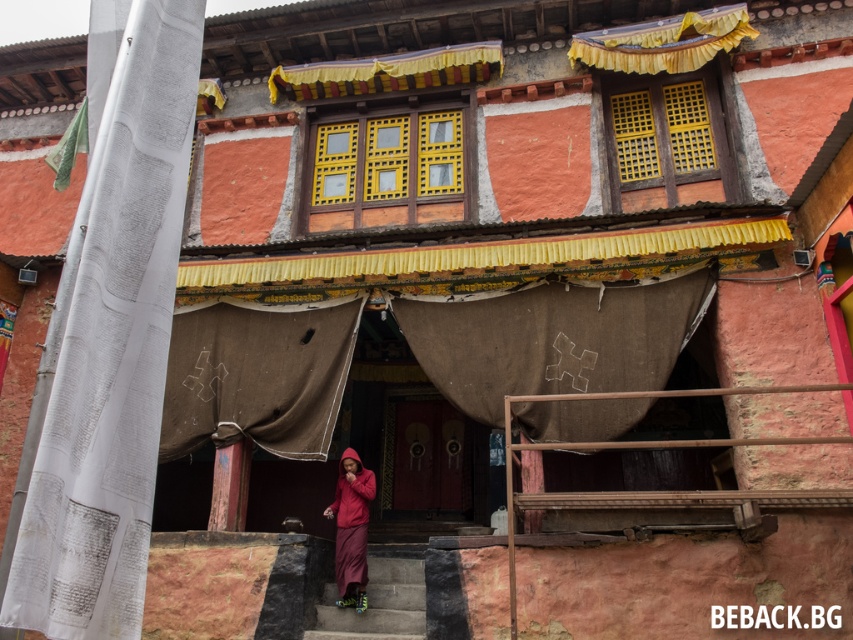
Question: Which object appears closest to the camera in this image?

Choices:
 (A) concrete stairs at center
 (B) matte red robe at center

Answer: (A)

Question: Does concrete stairs at center appear on the right side of matte red robe at center?

Choices:
 (A) no
 (B) yes

Answer: (B)

Question: Which of the following is the farthest from the observer?

Choices:
 (A) concrete stairs at center
 (B) matte red robe at center

Answer: (B)

Question: Which of the following is the closest to the observer?

Choices:
 (A) concrete stairs at center
 (B) matte red robe at center

Answer: (A)

Question: Is concrete stairs at center positioned at the back of matte red robe at center?

Choices:
 (A) no
 (B) yes

Answer: (A)

Question: Is concrete stairs at center bigger than matte red robe at center?

Choices:
 (A) no
 (B) yes

Answer: (B)